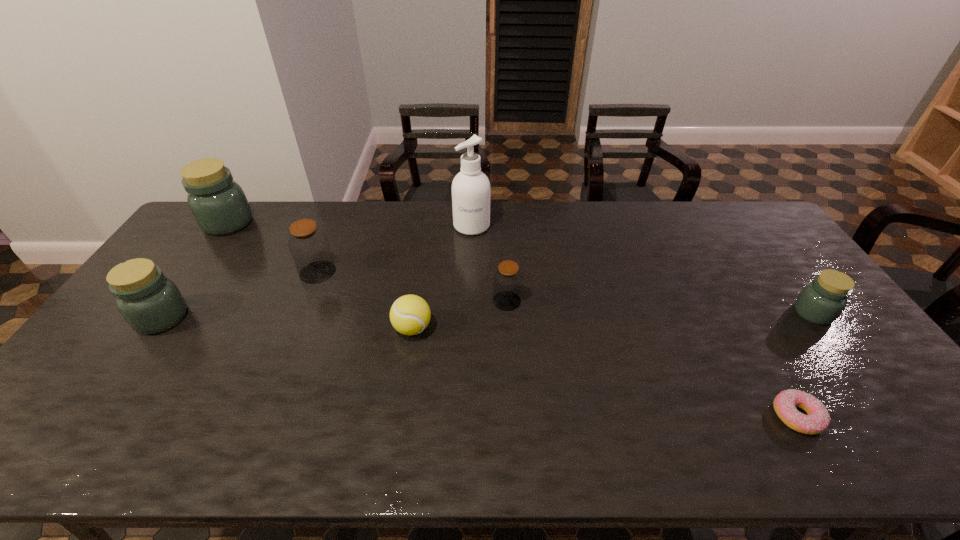
This screenshot has width=960, height=540. I want to click on free space between the rightmost jar and the second smallest green jar, so click(488, 315).

Where is `object identified as the seventh closest to the second biggest green jar`? The width and height of the screenshot is (960, 540). object identified as the seventh closest to the second biggest green jar is located at coordinates (821, 302).

Locate an element on the screen. This screenshot has height=540, width=960. object that stands as the seventh closest to the nearer brown jar is located at coordinates (218, 204).

At what (x,y) coordinates should I click in order to perform the action: click on jar that is the second closest to the rightmost jar. Please return your answer as a coordinate pair (x, y). The width and height of the screenshot is (960, 540). Looking at the image, I should click on (308, 244).

Image resolution: width=960 pixels, height=540 pixels. I want to click on jar that is the fifth closest to the cleansing agent, so click(x=821, y=302).

Find the location of `the second closest green jar to the fifth object from left to right`. the second closest green jar to the fifth object from left to right is located at coordinates (150, 303).

The height and width of the screenshot is (540, 960). I want to click on the closest green jar relative to the tallest object, so click(218, 204).

Image resolution: width=960 pixels, height=540 pixels. In order to click on free point that satisfies the following two spatial constraints: 1. on the front label of the seventh object from left to right; 2. on the left side of the fourth object from right to left in this screenshot , I will do `click(468, 416)`.

The height and width of the screenshot is (540, 960). In order to click on vacant position in the image that satisfies the following two spatial constraints: 1. on the front side of the fifth object from right to left; 2. on the left side of the left brown jar in this screenshot , I will do `click(296, 328)`.

Find the location of a particular element. vacant area in the image that satisfies the following two spatial constraints: 1. on the front side of the farther brown jar; 2. on the left side of the farthest green jar is located at coordinates (194, 272).